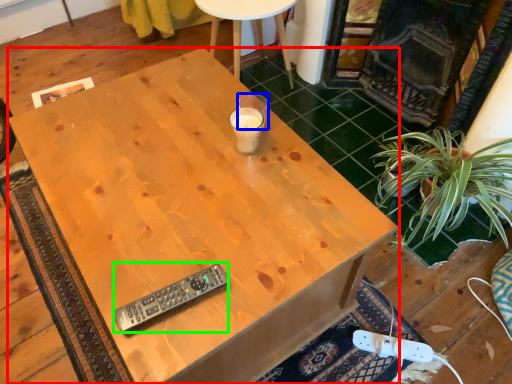
Question: Based on their relative distances, which object is farther from desk (highlighted by a red box)? Choose from coffee cup (highlighted by a blue box) and remote control (highlighted by a green box).

Choices:
 (A) coffee cup
 (B) remote control

Answer: (A)